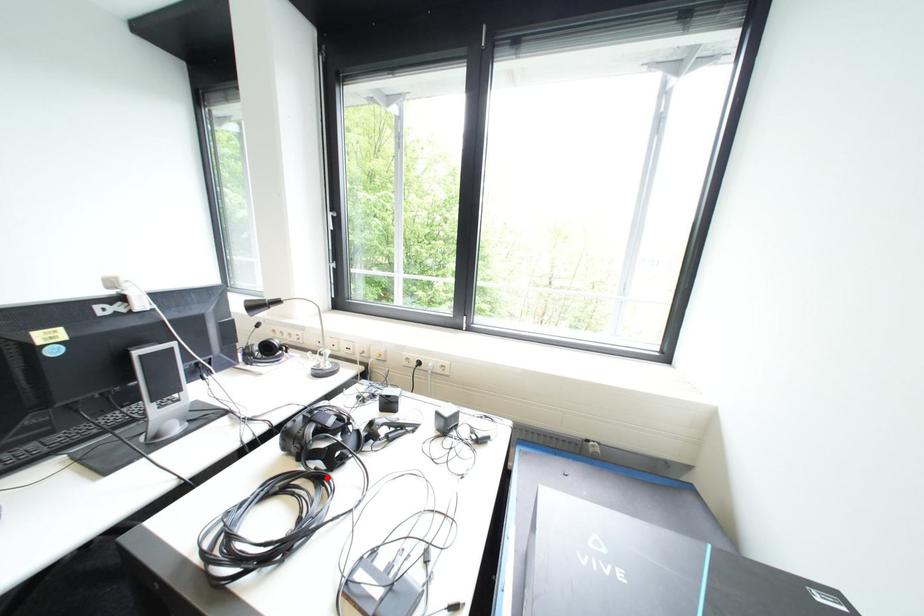
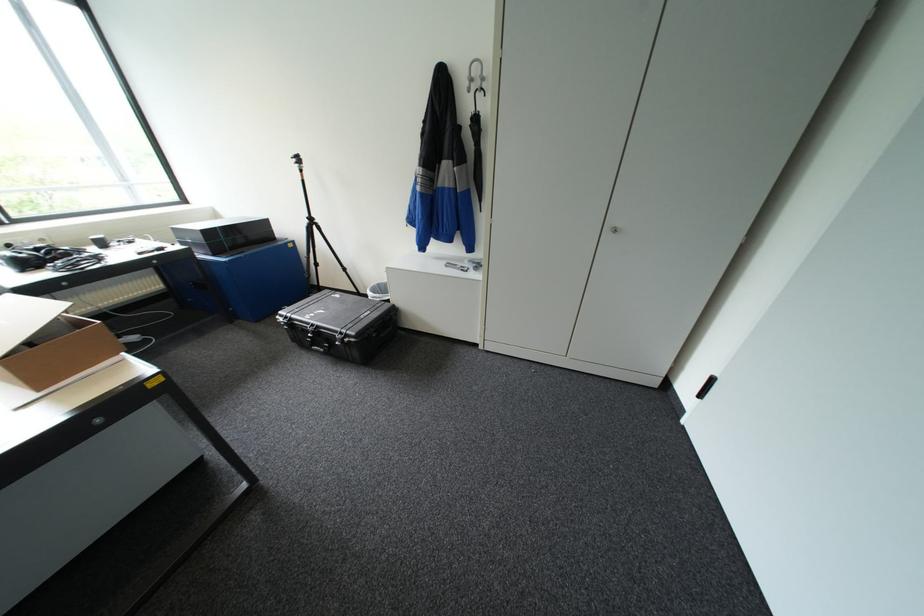
Question: I am providing you with two images of the same scene from different viewpoints. A red point is marked on the first image. Can you still see the location of the red point in image 2?

Choices:
 (A) Yes
 (B) No

Answer: (B)